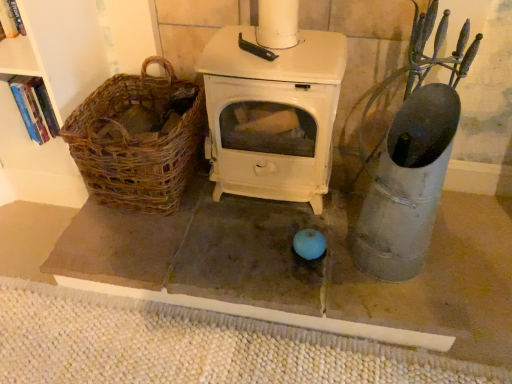
Find the location of a particular element. Image resolution: width=512 pixels, height=384 pixels. free space on the front side of woven brown basket at left is located at coordinates (138, 248).